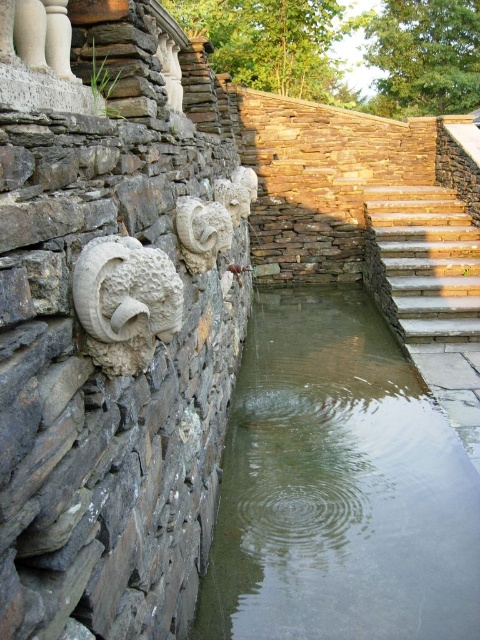
Question: Based on their relative distances, which object is nearer to the clear glass water at center?

Choices:
 (A) white stone ram at center
 (B) gray stone ram head at left
 (C) stone stairs at upper right

Answer: (B)

Question: Is clear glass water at center thinner than gray stone ram head at left?

Choices:
 (A) no
 (B) yes

Answer: (A)

Question: Which point is closer to the camera?

Choices:
 (A) [463, 627]
 (B) [414, 314]
 (C) [186, 227]
 (D) [144, 355]

Answer: (D)

Question: Which point is farther to the camera?

Choices:
 (A) stone stairs at upper right
 (B) gray stone ram head at left
 (C) white stone ram at center

Answer: (A)

Question: In this image, where is clear glass water at center located relative to white stone ram at center?

Choices:
 (A) left
 (B) right

Answer: (B)

Question: Is gray stone ram head at left below white stone ram at center?

Choices:
 (A) no
 (B) yes

Answer: (B)